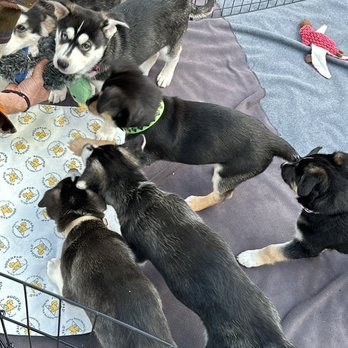
At what (x,y) coordinates should I click in order to perform the action: click on patterned blanket. Please return your answer as a coordinate pair (x, y). Looking at the image, I should click on (37, 175).